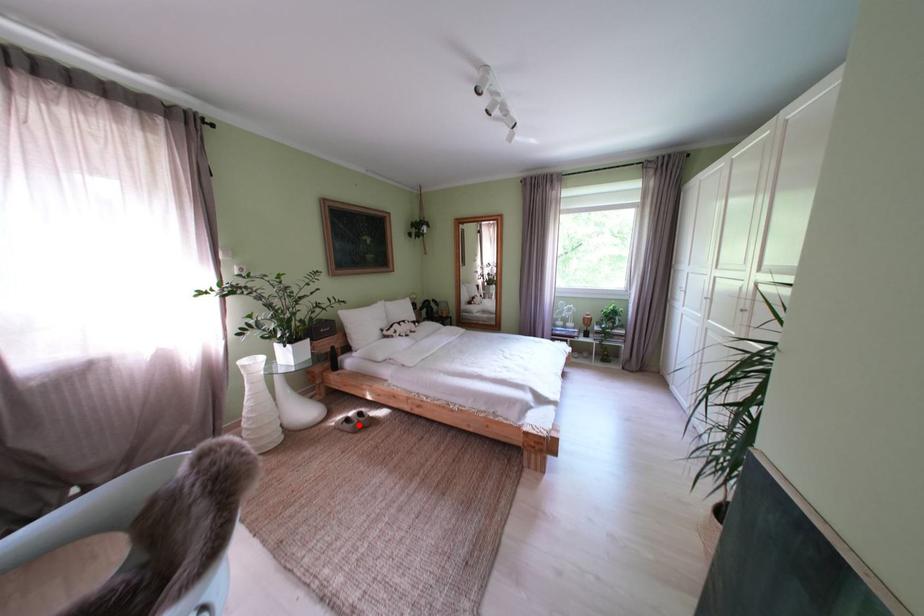
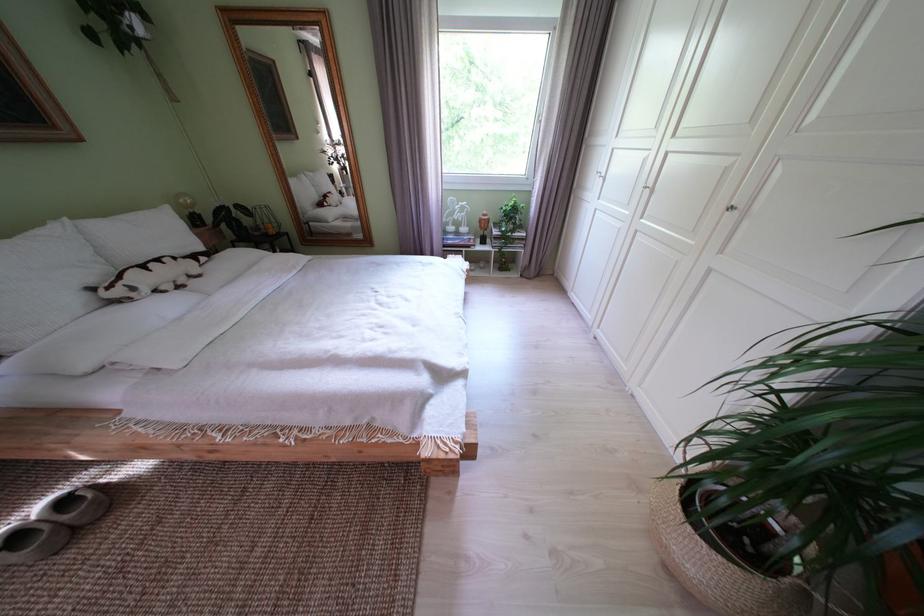
Question: I am providing you with two images of the same scene from different viewpoints. A red point is shown in image1. For the corresponding object point in image2, is it positioned nearer or farther from the camera?

Choices:
 (A) Nearer
 (B) Farther

Answer: (A)